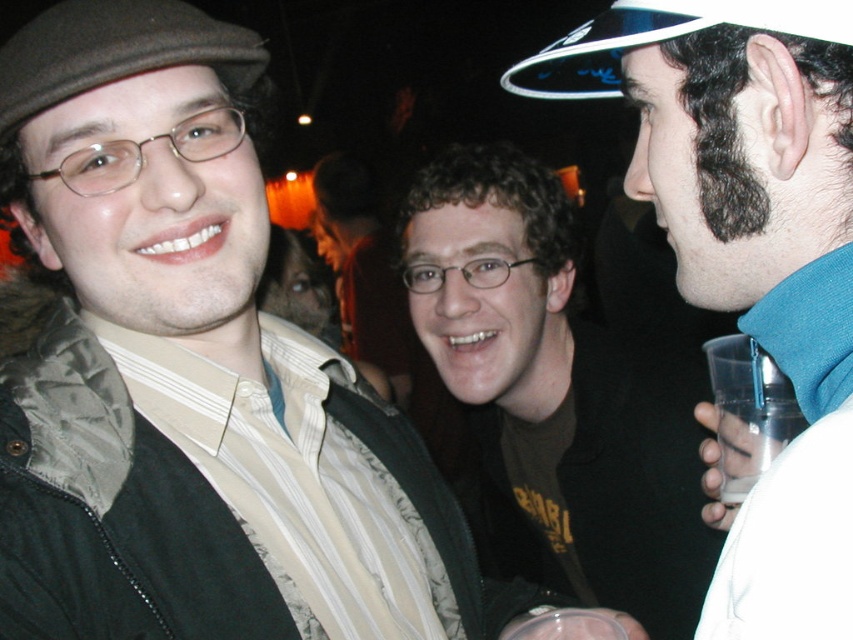
Who is positioned more to the right, blue fabric hat at upper right or clear plastic cup at lower right?

clear plastic cup at lower right is more to the right.

Is blue fabric hat at upper right taller than clear plastic cup at lower right?

Yes, blue fabric hat at upper right is taller than clear plastic cup at lower right.

Image resolution: width=853 pixels, height=640 pixels. I want to click on blue fabric hat at upper right, so click(660, 38).

Does blue fabric shirt at right have a larger size compared to clear plastic cup at lower right?

Yes.

Which is in front, point (727, 538) or point (778, 404)?

Point (727, 538)

Who is more forward, (822, 138) or (726, 442)?

Point (822, 138) is more forward.

At what (x,y) coordinates should I click in order to perform the action: click on blue fabric shirt at right. Please return your answer as a coordinate pair (x, y). Looking at the image, I should click on (749, 252).

Is the position of matte black jacket at left less distant than that of blue fabric shirt at right?

No, matte black jacket at left is further to the viewer.

At what (x,y) coordinates should I click in order to perform the action: click on matte black jacket at left. Please return your answer as a coordinate pair (x, y). Looking at the image, I should click on (189, 371).